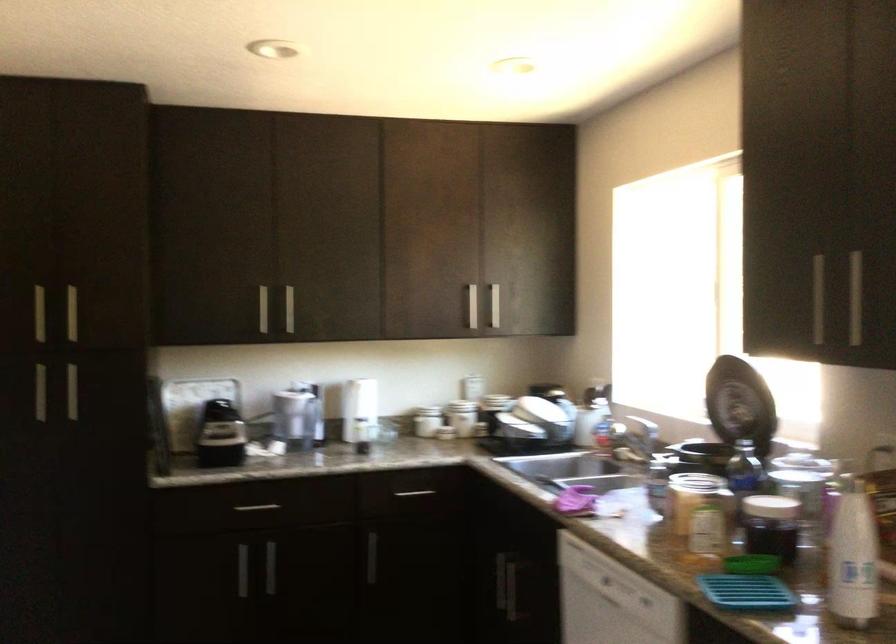
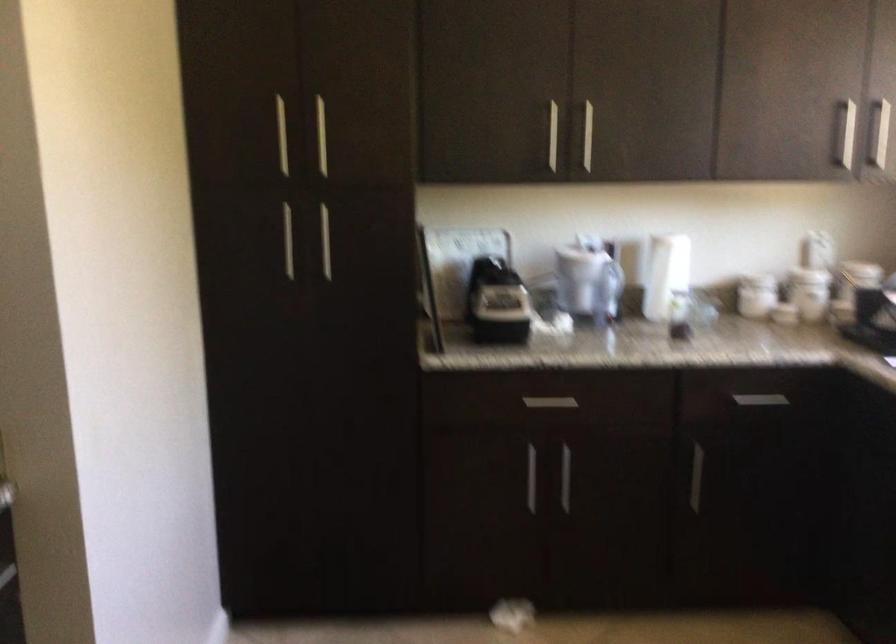
Question: I am providing you with two images of the same scene from different viewpoints. Which of the following objects are not visible in image2?

Choices:
 (A) white pitcher
 (B) silver drawer handle
 (C) silver cabinet handle
 (D) none of these

Answer: (D)